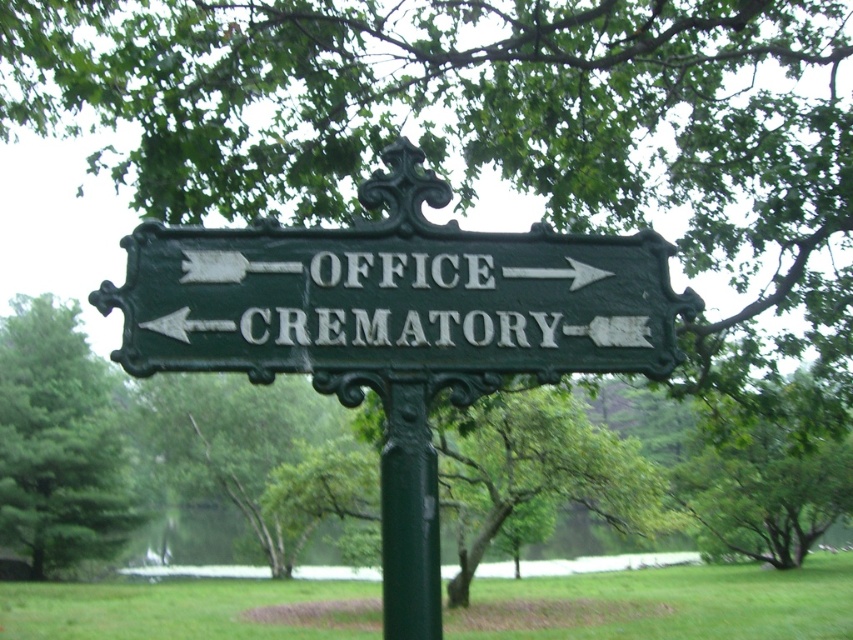
You are a delivery person with a 30 inch wide cart. You need to navigate through the space between the green cast iron sign at center and the green matte pole at center. Can your cart fit through the gap between them?

The gap between the green cast iron sign at center and the green matte pole at center is 29.29 inches. Since your cart is 30 inches wide, it is slightly wider than the available space. Therefore, your cart cannot fit through the gap between them.

You are standing in front of the green cast iron sign at center and want to get a clear view of the green leafy tree at left. Since the sign is blocking your view, which direction should you move to see the tree better?

The green cast iron sign at center is positioned over the green leafy tree at left, so you should move to the right of the sign to see the tree better.